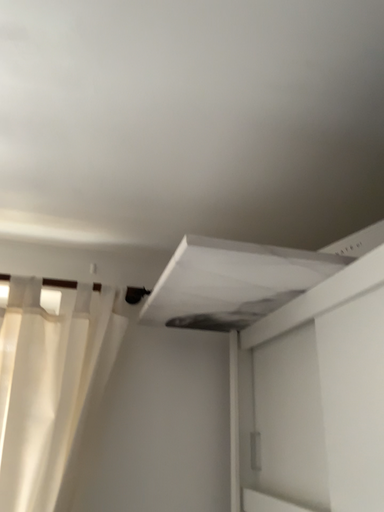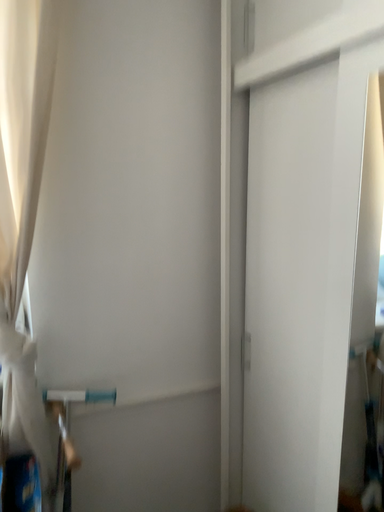
Question: How did the camera likely rotate when shooting the video?

Choices:
 (A) rotated upward
 (B) rotated downward

Answer: (B)